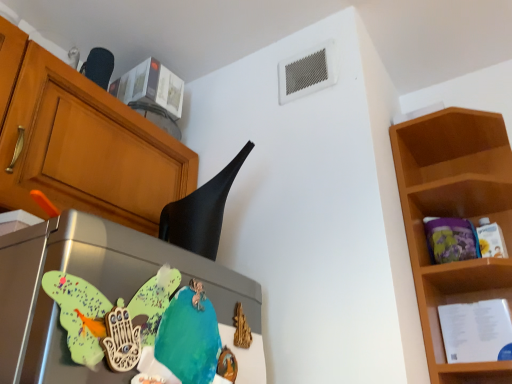
What is the approximate width of wooden shelf at right?

wooden shelf at right is 11.97 inches in width.

The height and width of the screenshot is (384, 512). I want to click on wooden shelf at right, so click(455, 216).

Where is `metallic refrigerator at center-left`? The image size is (512, 384). metallic refrigerator at center-left is located at coordinates (102, 292).

Does point (493, 373) lie behind point (229, 171)?

No, it is not.

Are wooden shelf at right and black matte exhaust hood at upper center making contact?

No, wooden shelf at right is not touching black matte exhaust hood at upper center.

Could black matte exhaust hood at upper center be considered to be inside wooden shelf at right?

That's incorrect, black matte exhaust hood at upper center is not inside wooden shelf at right.

Find the location of a particular element. shelf below the black matte exhaust hood at upper center (from the image's perspective) is located at coordinates (455, 216).

From a real-world perspective, which object rests below the other?

metallic refrigerator at center-left, from a real-world perspective.

Is metallic refrigerator at center-left not close to wooden shelf at right?

Actually, metallic refrigerator at center-left and wooden shelf at right are a little close together.

From the image's perspective, between metallic refrigerator at center-left and wooden shelf at right, who is located below?

wooden shelf at right.

Looking at their sizes, would you say metallic refrigerator at center-left is wider or thinner than black matte exhaust hood at upper center?

metallic refrigerator at center-left is thinner than black matte exhaust hood at upper center.

At what (x,y) coordinates should I click in order to perform the action: click on appliance lying in front of the black matte exhaust hood at upper center. Please return your answer as a coordinate pair (x, y). The width and height of the screenshot is (512, 384). Looking at the image, I should click on (102, 292).

Is metallic refrigerator at center-left not close to black matte exhaust hood at upper center?

metallic refrigerator at center-left is actually quite close to black matte exhaust hood at upper center.

Between metallic refrigerator at center-left and black matte exhaust hood at upper center, which one is positioned behind?

black matte exhaust hood at upper center.

Is wooden shelf at right located outside metallic refrigerator at center-left?

Indeed, wooden shelf at right is completely outside metallic refrigerator at center-left.

Considering the sizes of objects wooden shelf at right and metallic refrigerator at center-left in the image provided, who is wider, wooden shelf at right or metallic refrigerator at center-left?

Wider between the two is wooden shelf at right.

How much distance is there between wooden shelf at right and metallic refrigerator at center-left?

wooden shelf at right and metallic refrigerator at center-left are 67.80 centimeters apart from each other.

Does point (425, 152) appear closer or farther from the camera than point (35, 360)?

Point (425, 152) is positioned farther from the camera compared to point (35, 360).

Is black matte exhaust hood at upper center situated inside wooden shelf at right or outside?

black matte exhaust hood at upper center is not enclosed by wooden shelf at right.

Consider the image. Is black matte exhaust hood at upper center to the right of wooden shelf at right from the viewer's perspective?

No.

Can you confirm if black matte exhaust hood at upper center is smaller than wooden shelf at right?

Yes.

Is black matte exhaust hood at upper center next to wooden shelf at right and touching it?

They are not placed beside each other.

Is black matte exhaust hood at upper center not close to metallic refrigerator at center-left?

No, black matte exhaust hood at upper center is in close proximity to metallic refrigerator at center-left.

Is black matte exhaust hood at upper center bigger or smaller than metallic refrigerator at center-left?

black matte exhaust hood at upper center is bigger than metallic refrigerator at center-left.

What are the coordinates of `exhaust hood behind the metallic refrigerator at center-left` in the screenshot? It's located at (201, 212).

Based on the photo, from a real-world perspective, who is located higher, black matte exhaust hood at upper center or metallic refrigerator at center-left?

In real-world perspective, black matte exhaust hood at upper center is above.

What are the coordinates of `exhaust hood to the left of wooden shelf at right` in the screenshot? It's located at click(201, 212).

At what (x,y) coordinates should I click in order to perform the action: click on appliance below the wooden shelf at right (from a real-world perspective). Please return your answer as a coordinate pair (x, y). Looking at the image, I should click on (102, 292).

Estimate the real-world distances between objects in this image. Which object is closer to wooden shelf at right, black matte exhaust hood at upper center or metallic refrigerator at center-left?

Based on the image, black matte exhaust hood at upper center appears to be nearer to wooden shelf at right.

When comparing their distances from wooden shelf at right, does metallic refrigerator at center-left or black matte exhaust hood at upper center seem closer?

black matte exhaust hood at upper center lies closer to wooden shelf at right than the other object.

Consider the image. From the image, which object appears to be farther from black matte exhaust hood at upper center, wooden shelf at right or metallic refrigerator at center-left?

The object further to black matte exhaust hood at upper center is wooden shelf at right.

From the image, which object appears to be farther from metallic refrigerator at center-left, wooden shelf at right or black matte exhaust hood at upper center?

Based on the image, wooden shelf at right appears to be further to metallic refrigerator at center-left.

From the image, which object appears to be farther from black matte exhaust hood at upper center, metallic refrigerator at center-left or wooden shelf at right?

wooden shelf at right.

Looking at the image, which one is located closer to metallic refrigerator at center-left, black matte exhaust hood at upper center or wooden shelf at right?

Among the two, black matte exhaust hood at upper center is located nearer to metallic refrigerator at center-left.

Locate an element on the screen. The width and height of the screenshot is (512, 384). exhaust hood between metallic refrigerator at center-left and wooden shelf at right from left to right is located at coordinates (201, 212).